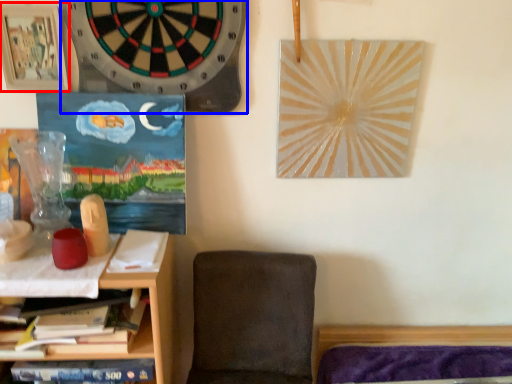
Question: Among these objects, which one is nearest to the camera, picture frame (highlighted by a red box) or clock (highlighted by a blue box)?

Choices:
 (A) picture frame
 (B) clock

Answer: (B)